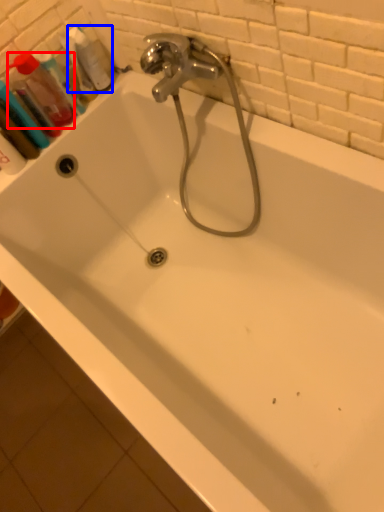
Question: Among these objects, which one is farthest to the camera, mouthwash (highlighted by a red box) or cleaning product (highlighted by a blue box)?

Choices:
 (A) mouthwash
 (B) cleaning product

Answer: (B)